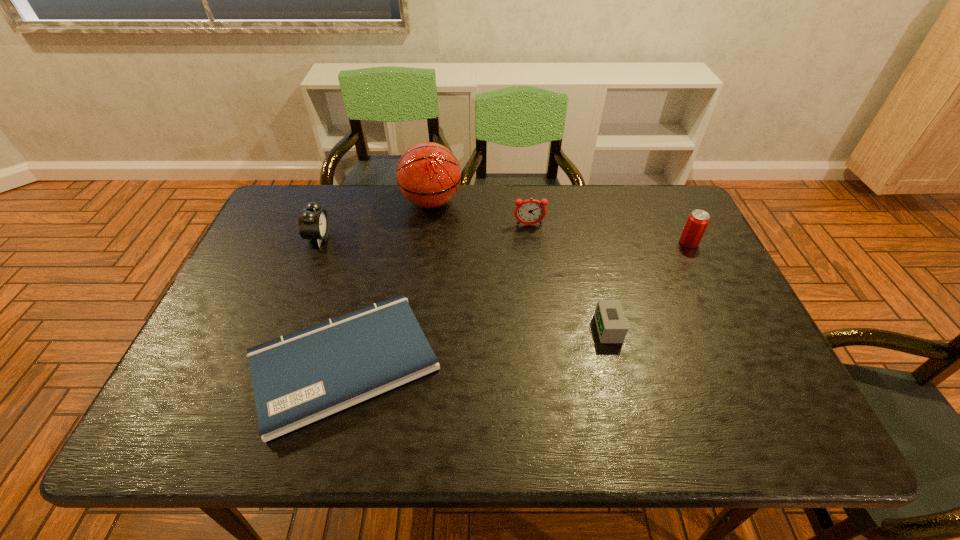
Locate an element on the screen. This screenshot has height=540, width=960. free area in between the rightmost alarm clock and the can is located at coordinates (649, 286).

Find the location of a particular element. This screenshot has width=960, height=540. free space between the fifth tallest object and the shortest object is located at coordinates (476, 346).

At what (x,y) coordinates should I click in order to perform the action: click on free space between the nearest alarm clock and the paperback book. Please return your answer as a coordinate pair (x, y). The width and height of the screenshot is (960, 540). Looking at the image, I should click on (476, 346).

This screenshot has width=960, height=540. What are the coordinates of `free space that is in between the tallest object and the leftmost alarm clock` in the screenshot? It's located at (375, 220).

What are the coordinates of `vacant space that's between the rightmost object and the tallest object` in the screenshot? It's located at (560, 222).

At what (x,y) coordinates should I click in order to perform the action: click on free spot between the basketball and the rightmost alarm clock. Please return your answer as a coordinate pair (x, y). This screenshot has height=540, width=960. Looking at the image, I should click on (520, 265).

At what (x,y) coordinates should I click in order to perform the action: click on free spot between the paperback book and the rightmost alarm clock. Please return your answer as a coordinate pair (x, y). The width and height of the screenshot is (960, 540). Looking at the image, I should click on (476, 346).

Where is `free point between the shortest alarm clock and the tallest object`? free point between the shortest alarm clock and the tallest object is located at coordinates (520, 265).

This screenshot has width=960, height=540. I want to click on object identified as the fifth closest to the second alarm clock from left to right, so click(x=313, y=223).

Find the location of a particular element. object that can be found as the second closest to the third object from right to left is located at coordinates (302, 377).